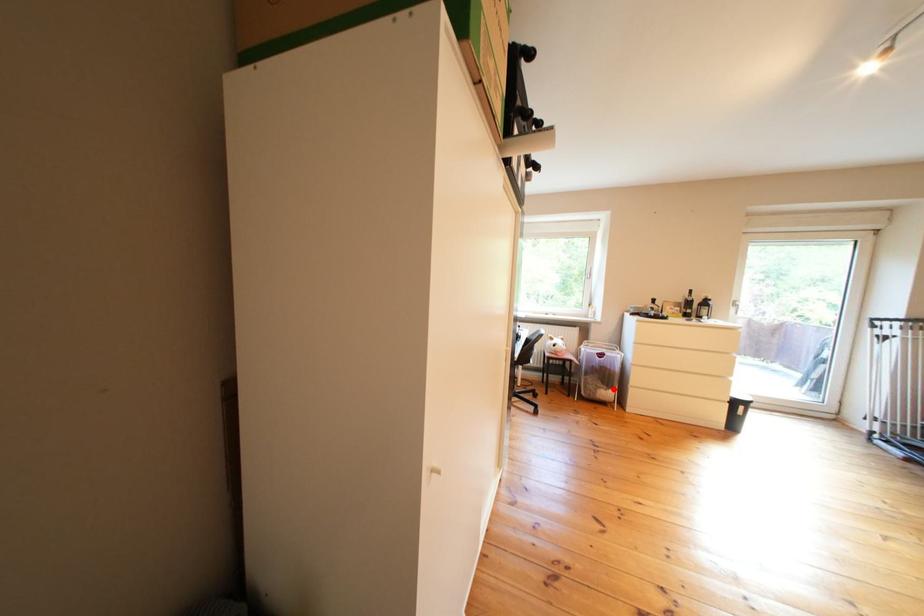
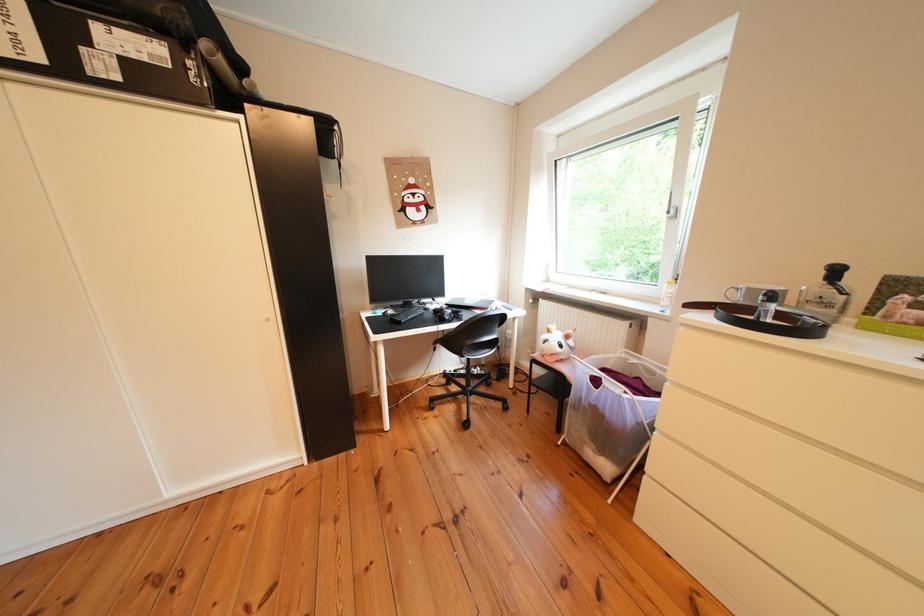
In the second image, find the point that corresponds to the highlighted location in the first image.

(601, 442)